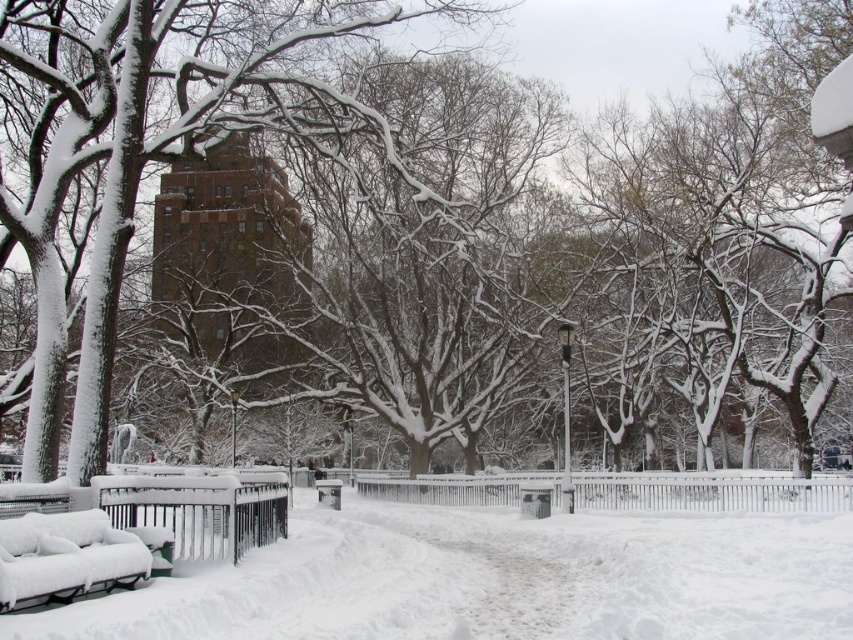
You are standing at the entrance of the park and see the point marked as point (492, 579). What is the color and texture of the surface at that point?

The surface at point (492, 579) is white and fluffy, as it is covered by the white fluffy snow at center.

You are standing at the starting point of the cleared pathway in the winter scene. There are two points marked on the path ahead of you. The first point is at coordinates point (114,598) and the second is at point (103,545). Which point is closer to your current position?

Point (114,598) is in front of point (103,545), so it is closer to your current position.